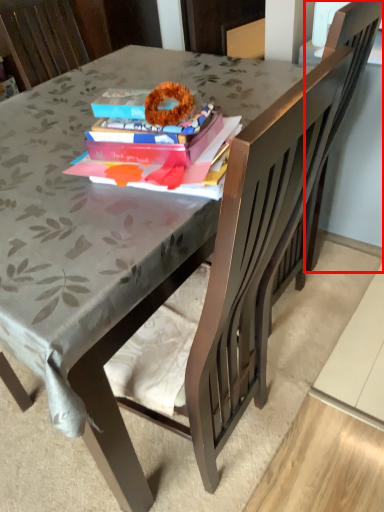
Question: From the image's perspective, considering the relative positions of swivel chair (annotated by the red box) and book in the image provided, where is swivel chair (annotated by the red box) located with respect to the staircase?

Choices:
 (A) above
 (B) below

Answer: (A)